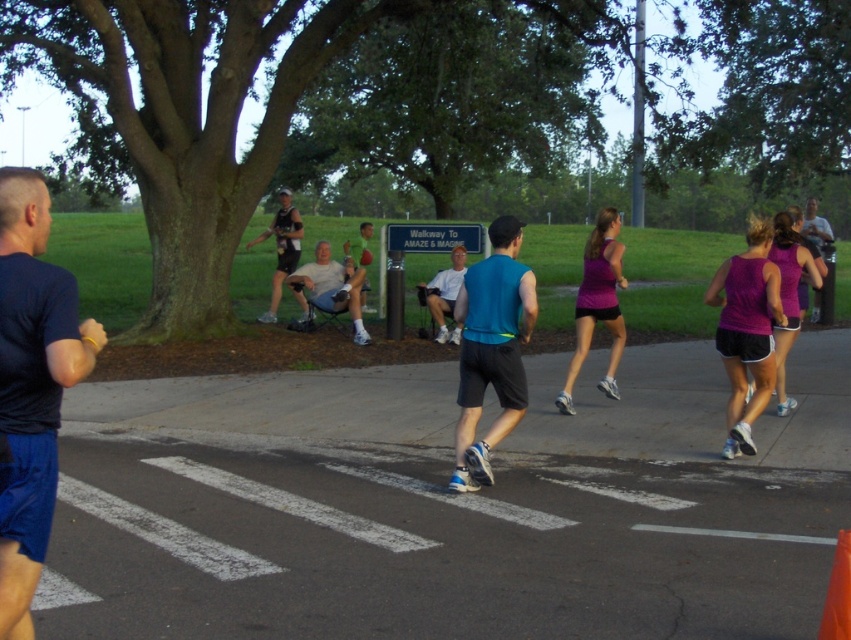
You are standing in the park and want to take a photo that includes both the point at coordinates (615, 333) and the point at coordinates (847, 538). Since the points are at different distances from you, which point should you focus on to ensure both are in focus?

You should focus on the point that is closer to you, which is point (847, 538), because focusing on the closer object increases the depth of field and helps both points be in focus.

You are a photographer trying to capture a clear shot of the matte blue shirt at center without the orange fabric cone at lower right blocking the view. Based on their positions, is this possible?

The matte blue shirt at center is positioned over the orange fabric cone at lower right, meaning the shirt is in front of the cone. Therefore, the photographer can capture a clear shot of the matte blue shirt at center without the orange fabric cone at lower right blocking the view since it is behind.

You are a photographer trying to capture a clear shot of both the dark blue fabric shirt at left and the matte blue shirt at center. Since you want both subjects to be visible, which one should you focus on first to ensure the other remains in focus?

You should focus on the dark blue fabric shirt at left first because it is in front of the matte blue shirt at center, so focusing on the closer subject will keep the background subject in focus as well.